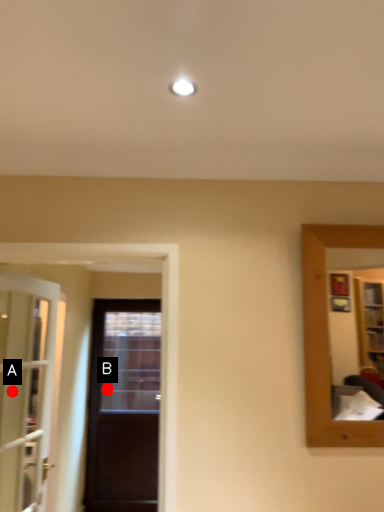
Question: Two points are circled on the image, labeled by A and B beside each circle. Among these points, which one is nearest to the camera?

Choices:
 (A) A is closer
 (B) B is closer

Answer: (A)